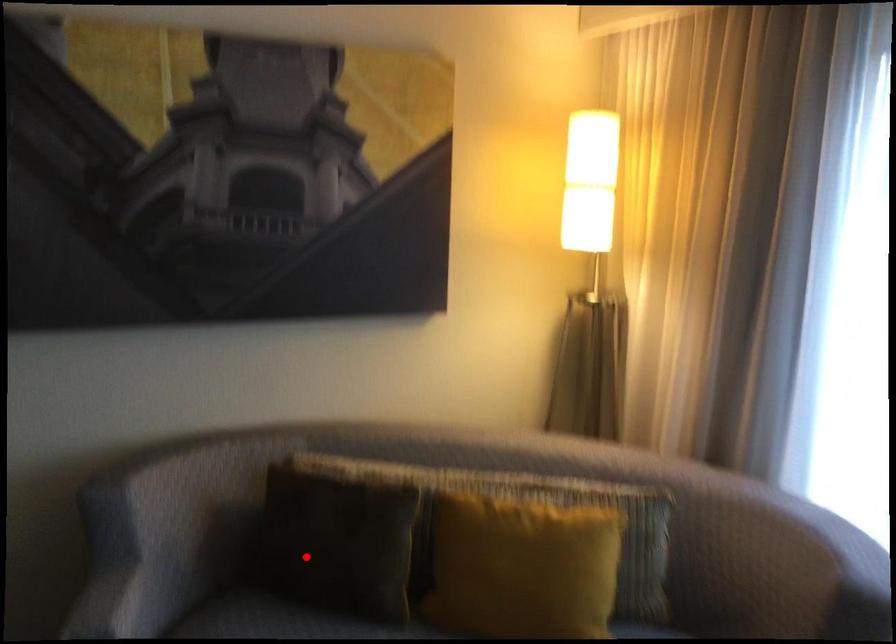
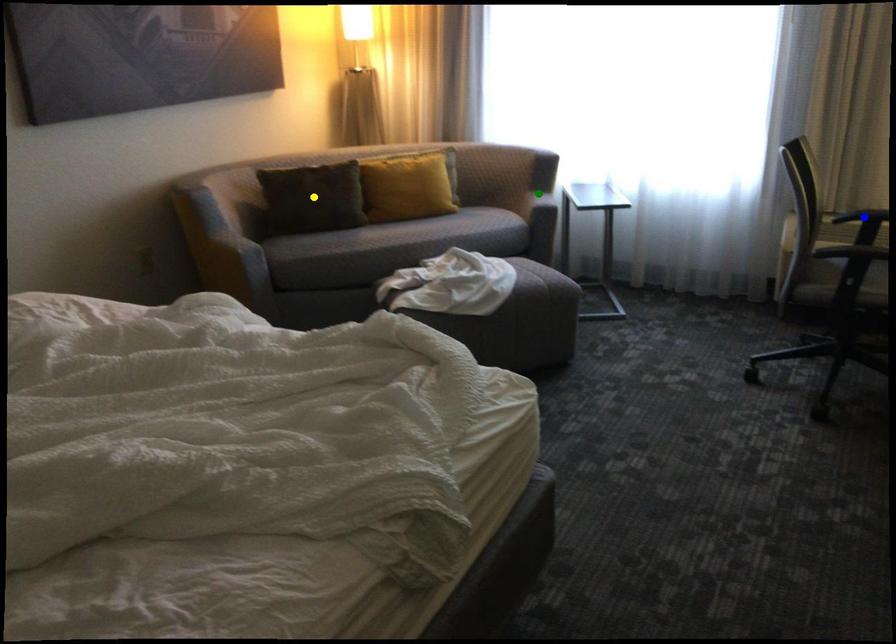
Question: I am providing you with two images of the same scene from different viewpoints. A red point is marked on the first image. You are given multiple points on the second image. Can you choose the point in image 2 that corresponds to the point in image 1?

Choices:
 (A) yellow point
 (B) green point
 (C) blue point

Answer: (A)